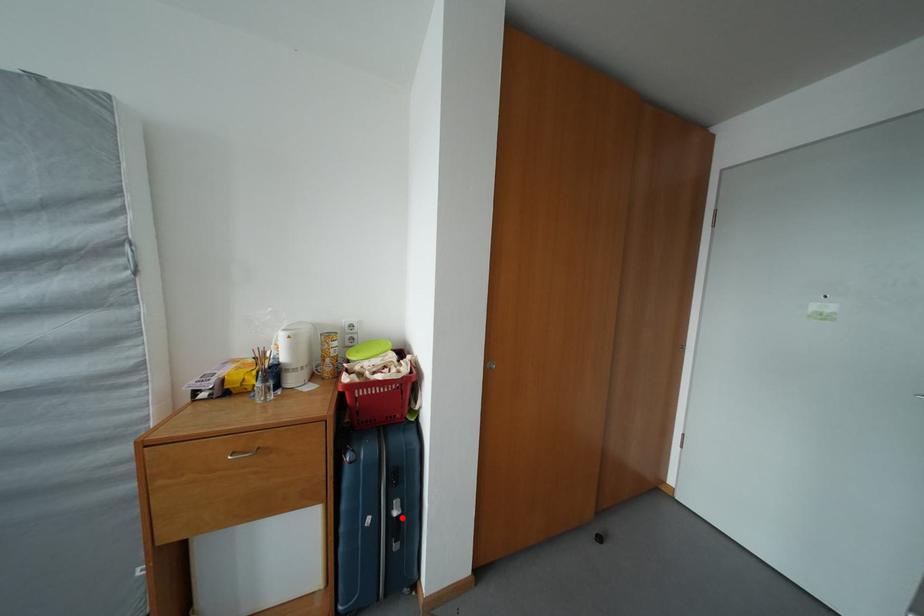
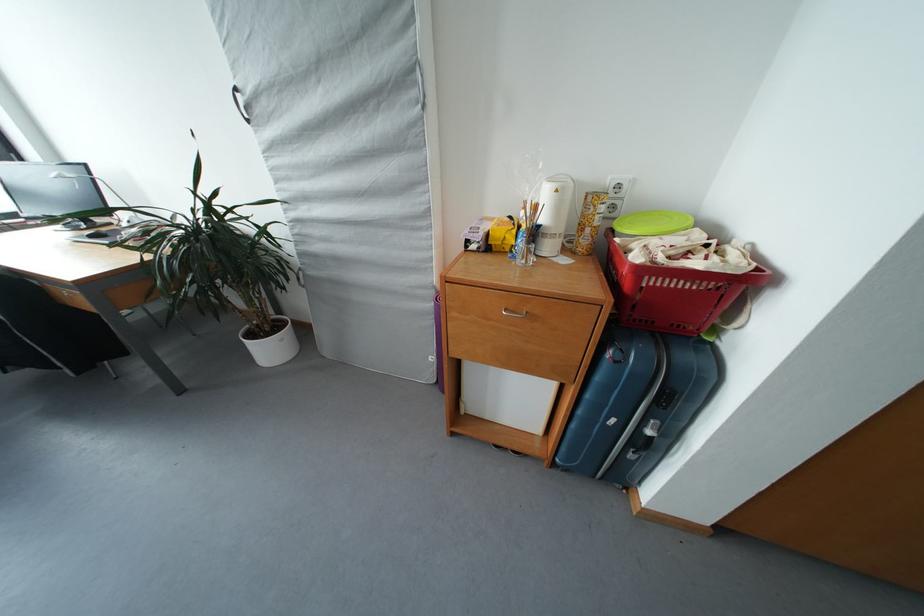
In the second image, find the point that corresponds to the highlighted location in the first image.

(655, 437)